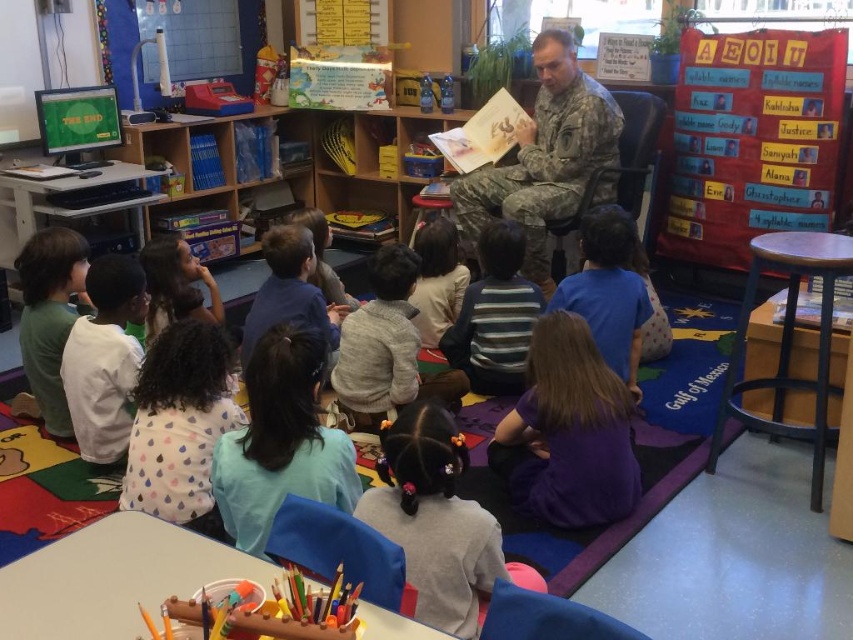
Which is behind, point (799, 72) or point (422, 502)?

Positioned behind is point (799, 72).

Who is more forward, (831, 81) or (434, 426)?

Positioned in front is point (434, 426).

Does point (804, 83) come in front of point (479, 593)?

No, it is behind (479, 593).

This screenshot has height=640, width=853. In order to click on red fabric banner at upper right in this screenshot , I will do `click(751, 140)`.

Is purple fabric at center shorter than green matte shirt at left?

Yes, purple fabric at center is shorter than green matte shirt at left.

Between purple fabric at center and green matte shirt at left, which one is positioned higher?

green matte shirt at left

The image size is (853, 640). What do you see at coordinates (567, 433) in the screenshot? I see `purple fabric at center` at bounding box center [567, 433].

Where is `purple fabric at center`? The height and width of the screenshot is (640, 853). purple fabric at center is located at coordinates (567, 433).

Is point (94, 387) positioned behind point (45, 396)?

No, it is in front of (45, 396).

Can you confirm if white cotton shirt at left is positioned to the right of green matte shirt at left?

Indeed, white cotton shirt at left is positioned on the right side of green matte shirt at left.

Between point (97, 400) and point (33, 403), which one is positioned behind?

Point (33, 403)

Find the location of a particular element. white cotton shirt at left is located at coordinates (105, 358).